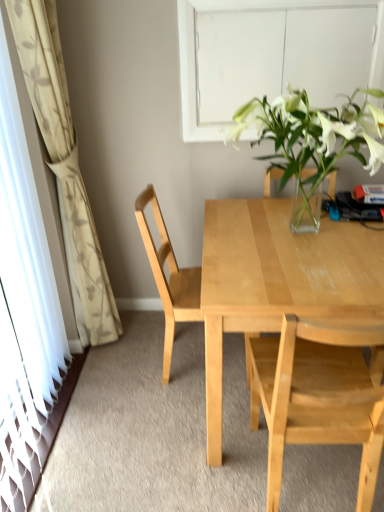
Where is `free space in front of light wood chair at center, the 2th chair positioned from the front`? Image resolution: width=384 pixels, height=512 pixels. free space in front of light wood chair at center, the 2th chair positioned from the front is located at coordinates (170, 424).